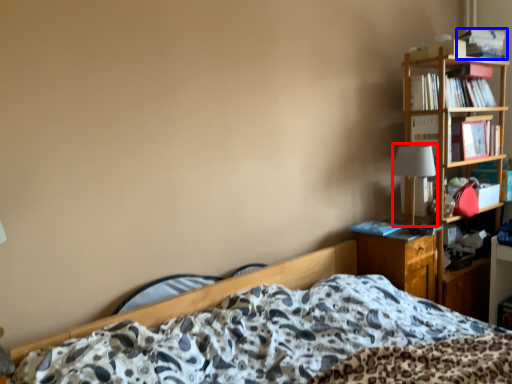
Question: Which object appears farthest to the camera in this image, table lamp (highlighted by a red box) or book (highlighted by a blue box)?

Choices:
 (A) table lamp
 (B) book

Answer: (B)